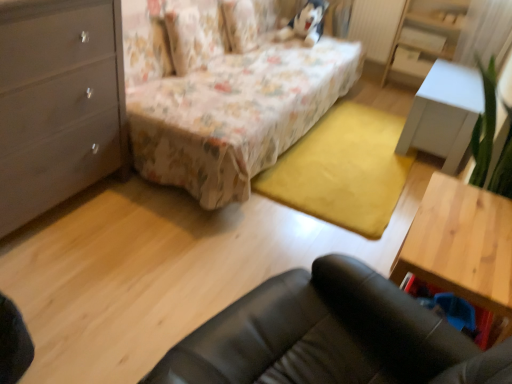
Question: Could you tell me if wooden table at lower right, positioned as the first table in front-to-back order, is facing floral fabric bed at center?

Choices:
 (A) no
 (B) yes

Answer: (B)

Question: From a real-world perspective, is wooden table at lower right, positioned as the first table in front-to-back order, physically above floral fabric bed at center?

Choices:
 (A) no
 (B) yes

Answer: (A)

Question: Is wooden table at lower right, which is the 1th table in bottom-to-top order, turned away from floral fabric bed at center?

Choices:
 (A) yes
 (B) no

Answer: (B)

Question: Considering the relative sizes of wooden table at lower right, positioned as the second table in back-to-front order, and floral fabric bed at center in the image provided, is wooden table at lower right, positioned as the second table in back-to-front order, thinner than floral fabric bed at center?

Choices:
 (A) yes
 (B) no

Answer: (A)

Question: Can you confirm if wooden table at lower right, the 1th table positioned from the left, is positioned to the left of floral fabric bed at center?

Choices:
 (A) yes
 (B) no

Answer: (B)

Question: Is point pyautogui.click(x=178, y=130) closer or farther from the camera than point pyautogui.click(x=11, y=31)?

Choices:
 (A) farther
 (B) closer

Answer: (A)

Question: From the image's perspective, relative to matte gray dresser at left, is floral fabric bed at center above or below?

Choices:
 (A) above
 (B) below

Answer: (A)

Question: Considering the positions of floral fabric bed at center and matte gray dresser at left in the image, is floral fabric bed at center wider or thinner than matte gray dresser at left?

Choices:
 (A) thin
 (B) wide

Answer: (B)

Question: Based on their sizes in the image, would you say floral fabric bed at center is bigger or smaller than matte gray dresser at left?

Choices:
 (A) big
 (B) small

Answer: (A)

Question: Is white glossy table at right, the second table in the bottom-to-top sequence, inside the boundaries of floral fabric bed at center, or outside?

Choices:
 (A) inside
 (B) outside

Answer: (B)

Question: From the image's perspective, is white glossy table at right, placed as the 1th table when sorted from top to bottom, above or below floral fabric bed at center?

Choices:
 (A) above
 (B) below

Answer: (B)

Question: Looking at the image, does white glossy table at right, the 2th table from the left, seem bigger or smaller compared to floral fabric bed at center?

Choices:
 (A) big
 (B) small

Answer: (B)

Question: Is white glossy table at right, placed as the 1th table when sorted from top to bottom, wider or thinner than floral fabric bed at center?

Choices:
 (A) wide
 (B) thin

Answer: (B)

Question: From the image's perspective, relative to floral fabric pillow at upper center, is white glossy table at right, the 1th table positioned from the back, above or below?

Choices:
 (A) above
 (B) below

Answer: (B)

Question: Is point (459, 69) positioned closer to the camera than point (174, 64)?

Choices:
 (A) closer
 (B) farther

Answer: (B)